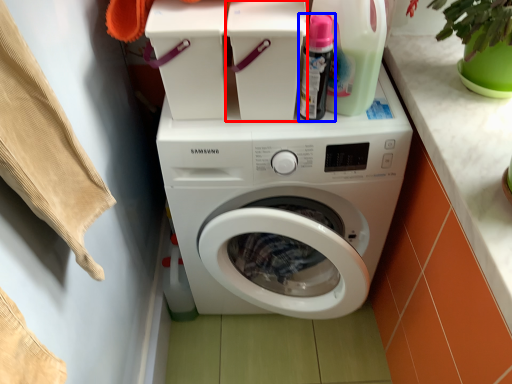
Question: Which object appears farthest to the camera in this image, appliance (highlighted by a red box) or cleaning product (highlighted by a blue box)?

Choices:
 (A) appliance
 (B) cleaning product

Answer: (A)